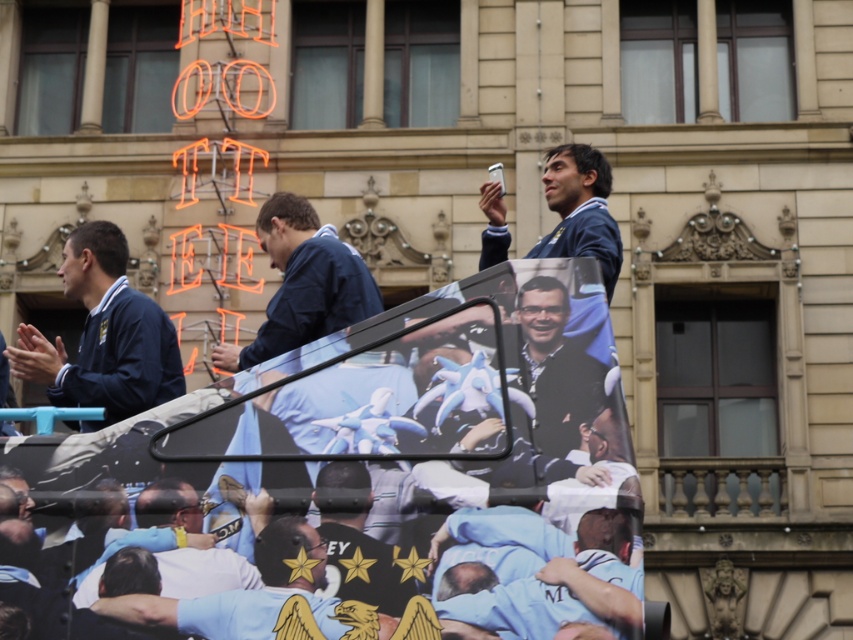
You are a photographer trying to capture both the matte blue jacket at left and the blue fabric jacket at center in a single frame. Given their sizes, which jacket will appear bigger in your photo?

The matte blue jacket at left will appear bigger in the photo because it is larger in size than the blue fabric jacket at center.

You are a photographer trying to capture a photo of the blue fabric banner at center and the blue fabric jacket at upper center. Which object should you focus on first if you want to include both in your frame without moving the camera?

The blue fabric banner at center might be wider than the blue fabric jacket at upper center, so you should focus on the wider blue fabric banner at center first to ensure it fits in the frame.

You are a photographer at the event and want to capture both the blue fabric banner at center and the blue fabric jacket at center in one shot. Which one should you focus on first to ensure they are both in frame?

The blue fabric banner at center is below the blue fabric jacket at center, so you should focus on the blue fabric jacket at center first to ensure both are in frame.